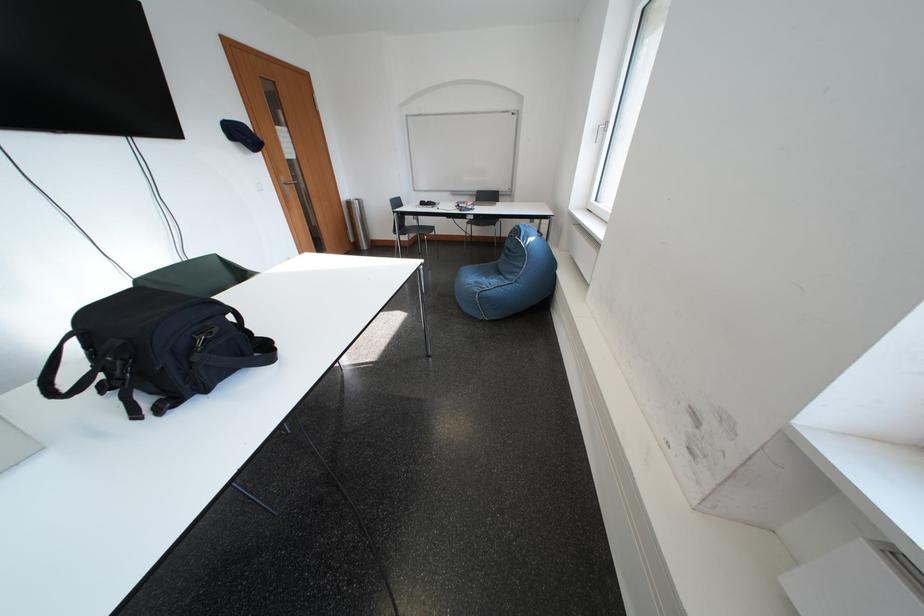
Which object does [485,197] point to?

It refers to a closed laptop.